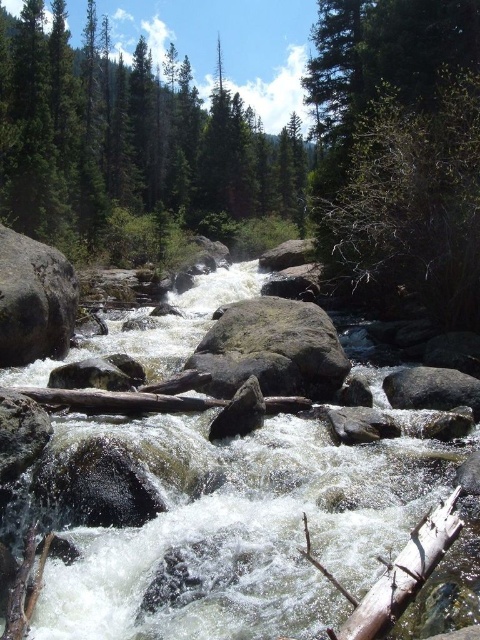
Which of these two, white frothy water at center or gray rough boulder at left, stands taller?

With more height is gray rough boulder at left.

Is white frothy water at center shorter than gray rough boulder at left?

Correct, white frothy water at center is not as tall as gray rough boulder at left.

Image resolution: width=480 pixels, height=640 pixels. I want to click on white frothy water at center, so click(240, 528).

Is green matte tree at upper center positioned before gray rough boulder at left?

No, it is behind gray rough boulder at left.

Does green matte tree at upper center come behind gray rough boulder at left?

That is True.

What do you see at coordinates (133, 145) in the screenshot? This screenshot has width=480, height=640. I see `green matte tree at upper center` at bounding box center [133, 145].

You are a GUI agent. You are given a task and a screenshot of the screen. Output one action in this format:
    pyautogui.click(x=<x>, y=<y>)
    Task: Click on the green matte tree at upper center
    This screenshot has height=640, width=480.
    Given the screenshot: What is the action you would take?
    pyautogui.click(x=133, y=145)

Does green matte tree at upper center come in front of gray rough boulder at center?

No, it is behind gray rough boulder at center.

Who is positioned more to the left, green matte tree at upper center or gray rough boulder at center?

gray rough boulder at center

Does point (33, 168) lie behind point (208, 333)?

Yes.

Find the location of a particular element. green matte tree at upper center is located at coordinates (133, 145).